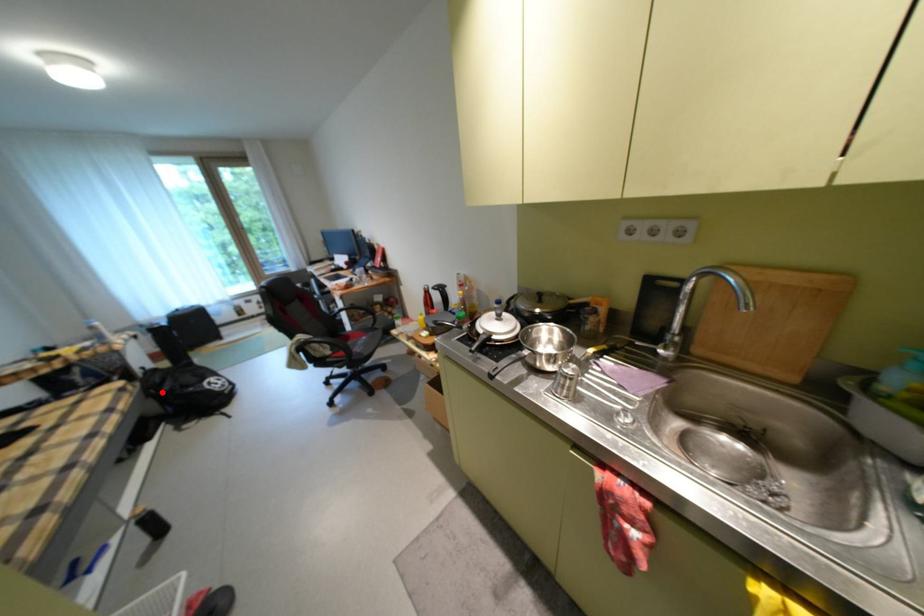
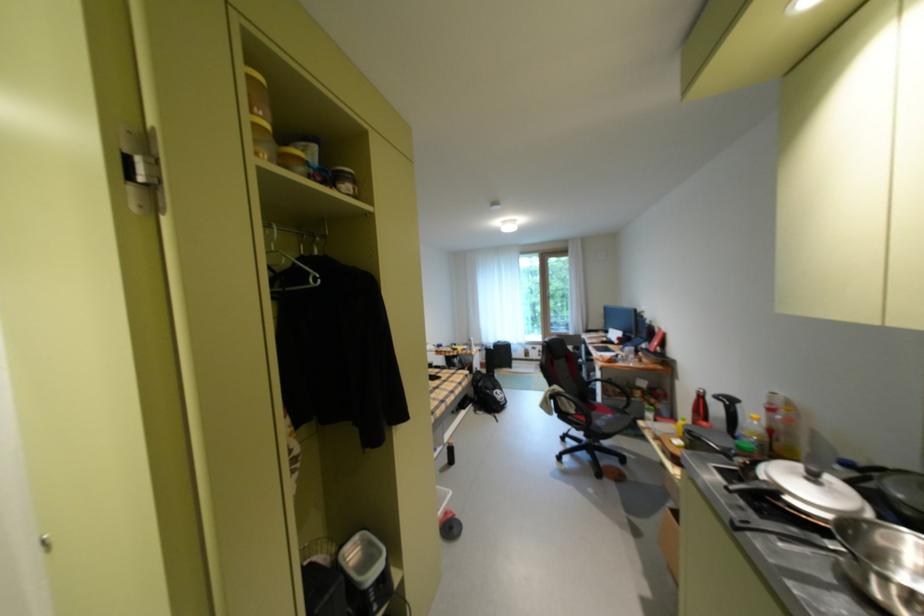
Locate, in the second image, the point that corresponds to the highlighted location in the first image.

(484, 384)